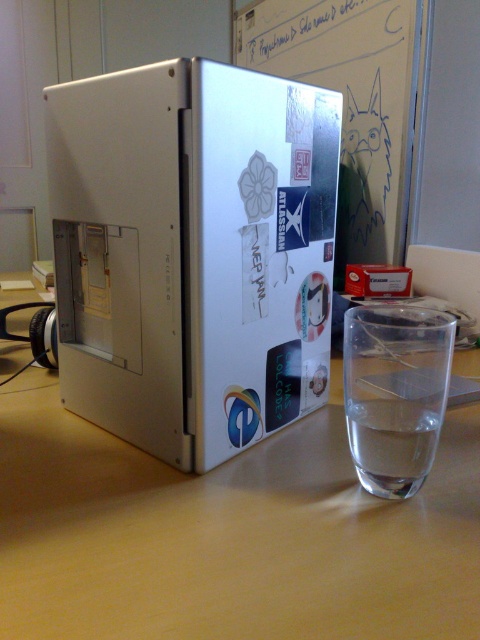
You are organizing a desk and need to place a new keyboard between the matte plastic computer case at center and the transparent glass at right. Based on their current positions, which object should the keyboard be placed to the right of?

The keyboard should be placed to the right of the matte plastic computer case at center because it is positioned to the left of the transparent glass at right.

You are trying to locate the satin silver laptop at center in the image. Can you tell me its coordinates?

The satin silver laptop at center is located at coordinates point (192, 253).